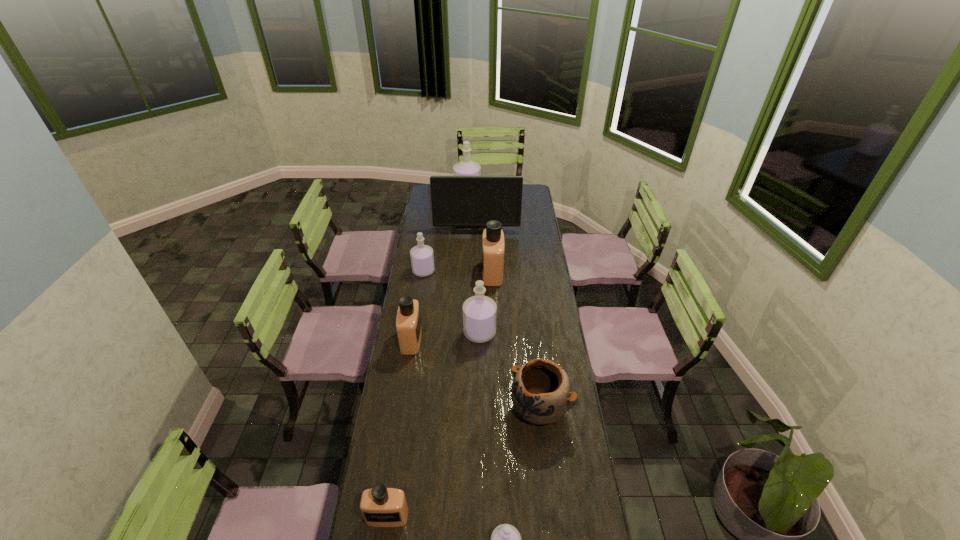
Locate an element on the screen. the third nearest object is located at coordinates (541, 393).

Find the location of `pottery`. pottery is located at coordinates (541, 393).

This screenshot has height=540, width=960. Identify the location of the nearest beige perfume. (380, 506).

Locate an element on the screen. The height and width of the screenshot is (540, 960). the second nearest perfume is located at coordinates (380, 506).

The height and width of the screenshot is (540, 960). Identify the location of free spot located 0.260m on the right of the biggest purple perfume. (520, 194).

This screenshot has height=540, width=960. In order to click on vacant space located 0.150m on the screen side of the computer monitor in this screenshot , I will do `click(476, 250)`.

The width and height of the screenshot is (960, 540). In order to click on free spot located on the front label of the biggest beige perfume in this screenshot , I will do `click(472, 273)`.

You are a GUI agent. You are given a task and a screenshot of the screen. Output one action in this format:
    pyautogui.click(x=<x>, y=<y>)
    Task: Click on the vacant area located 0.260m on the front label of the biggest beige perfume
    This screenshot has height=540, width=960.
    Given the screenshot: What is the action you would take?
    pyautogui.click(x=432, y=273)

The height and width of the screenshot is (540, 960). I want to click on vacant space located 0.160m on the front label of the biggest beige perfume, so click(451, 273).

At what (x,y) coordinates should I click in order to perform the action: click on free location located on the left of the third farthest purple perfume. Please return your answer as a coordinate pair (x, y). This screenshot has width=960, height=540. Looking at the image, I should click on (430, 332).